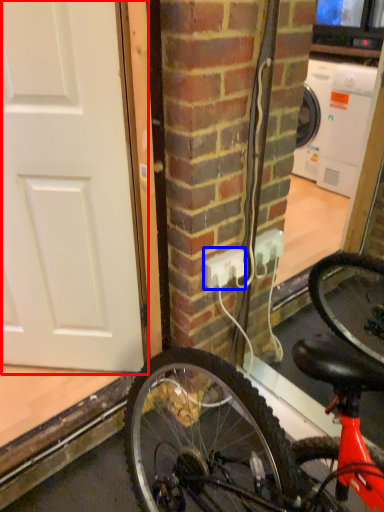
Question: Which object appears farthest to the camera in this image, door (highlighted by a red box) or power outlet (highlighted by a blue box)?

Choices:
 (A) door
 (B) power outlet

Answer: (B)